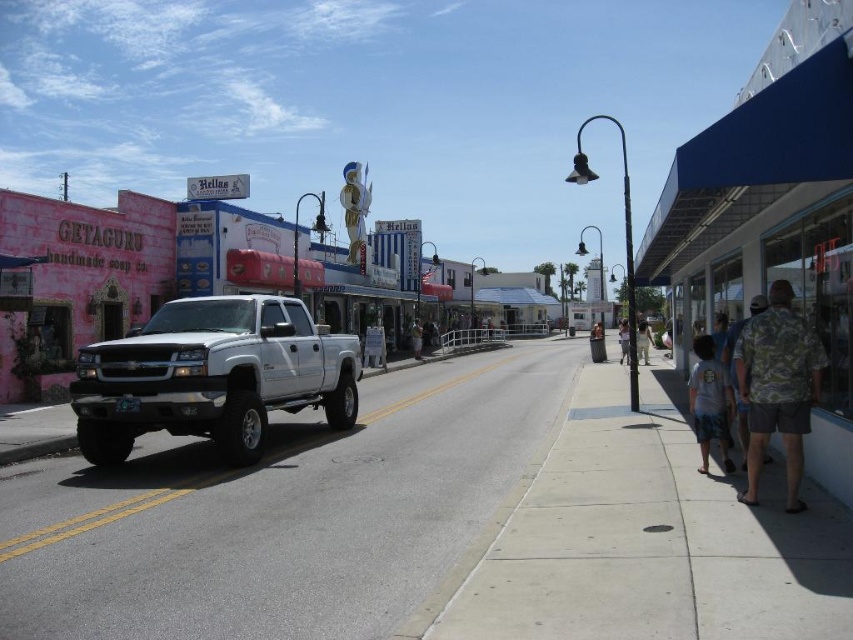
This screenshot has width=853, height=640. In order to click on white cotton shirt at lower right in this screenshot , I will do `click(709, 403)`.

Between white cotton shirt at lower right and camouflage shirt at center, which one appears on the left side from the viewer's perspective?

From the viewer's perspective, white cotton shirt at lower right appears more on the left side.

Is point (692, 346) positioned in front of point (625, 342)?

Yes, it is.

Where is `white cotton shirt at lower right`? white cotton shirt at lower right is located at coordinates (709, 403).

Does camouflage fabric shirt at right have a larger size compared to white cotton shirt at center?

Actually, camouflage fabric shirt at right might be smaller than white cotton shirt at center.

Is camouflage fabric shirt at right to the left of white cotton shirt at center from the viewer's perspective?

Indeed, camouflage fabric shirt at right is positioned on the left side of white cotton shirt at center.

In order to click on camouflage fabric shirt at right in this screenshot , I will do `click(735, 371)`.

Is concrete sidewalk at lower right further to camera compared to camouflage fabric shirt at right?

No.

Which is in front, point (589, 630) or point (746, 435)?

Positioned in front is point (589, 630).

This screenshot has height=640, width=853. Find the location of `concrete sidewalk at lower right`. concrete sidewalk at lower right is located at coordinates (651, 540).